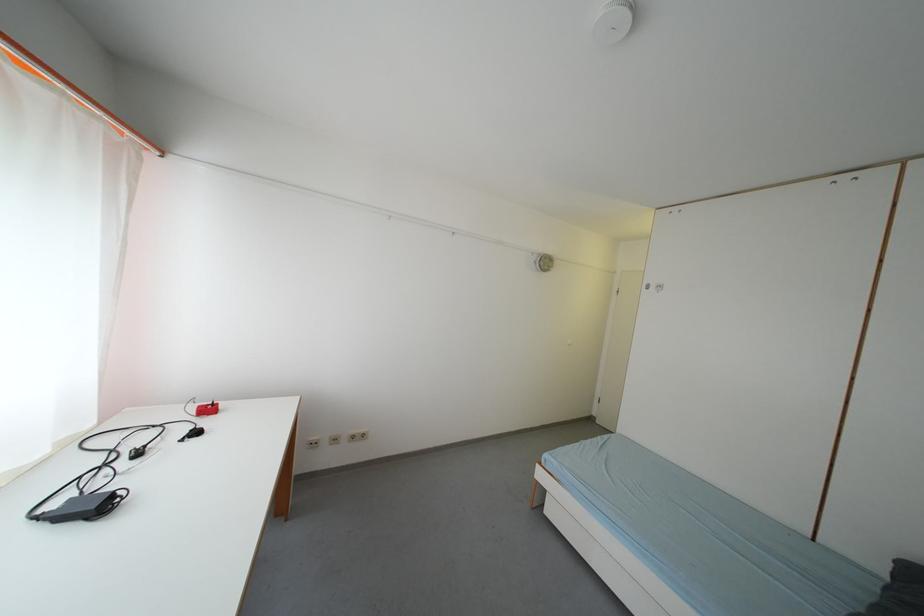
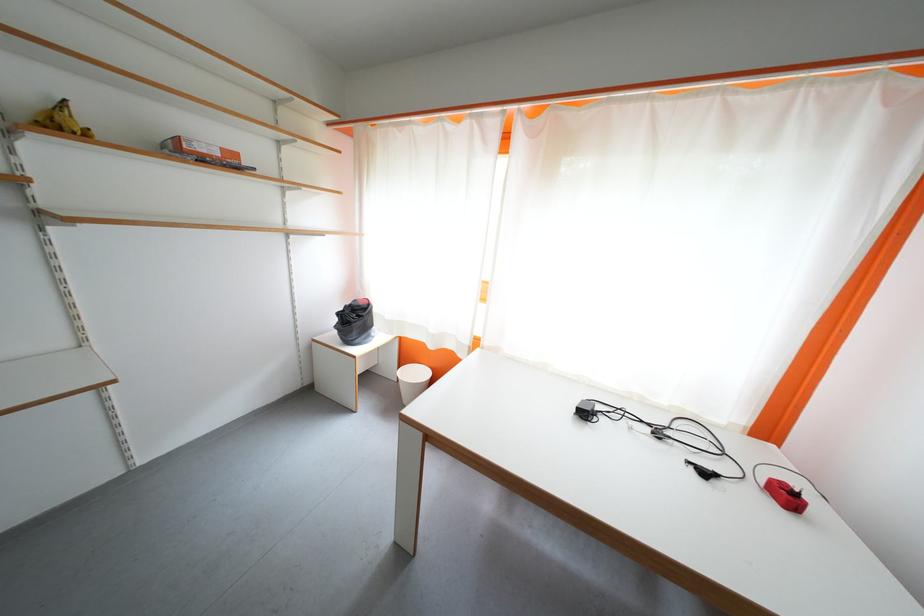
Find the pixel in the second image that matches pixel 205 436 in the first image.

(713, 477)